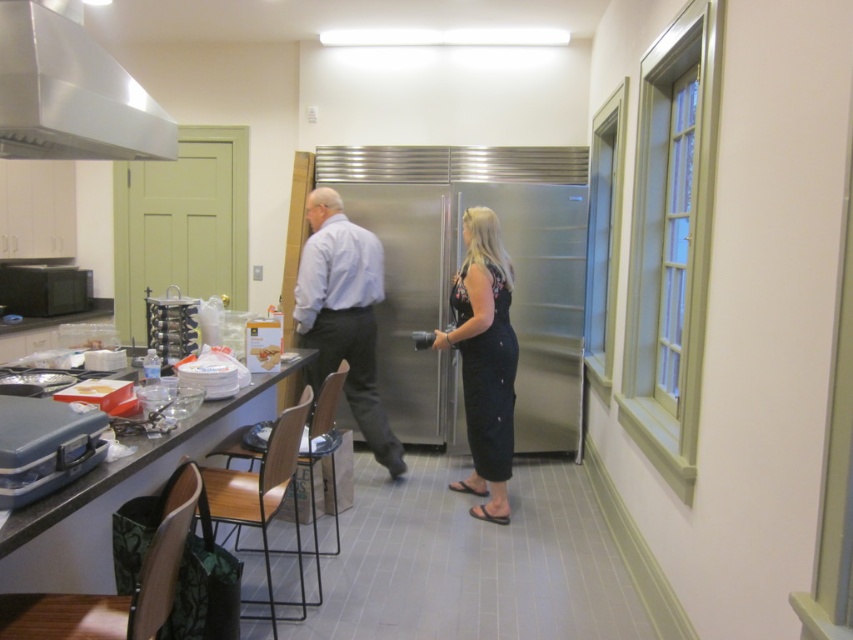
This screenshot has height=640, width=853. In order to click on stainless steel exhaust hood at upper left in this screenshot , I will do `click(70, 93)`.

Measure the distance between point (94, 129) and camera.

A distance of 7.19 feet exists between point (94, 129) and camera.

Who is more distant from viewer, (9, 58) or (352, 275)?

Point (352, 275)

This screenshot has height=640, width=853. Find the location of `stainless steel exhaust hood at upper left`. stainless steel exhaust hood at upper left is located at coordinates (70, 93).

Who is shorter, stainless steel exhaust hood at upper left or stainless steel refrigerator at center?

stainless steel exhaust hood at upper left is shorter.

Can you confirm if stainless steel exhaust hood at upper left is wider than stainless steel refrigerator at center?

Yes, stainless steel exhaust hood at upper left is wider than stainless steel refrigerator at center.

Locate an element on the screen. Image resolution: width=853 pixels, height=640 pixels. stainless steel exhaust hood at upper left is located at coordinates (70, 93).

Which is below, light blue shirt at center or black floral dress at center?

black floral dress at center is lower down.

From the picture: Who is more forward, (381, 449) or (474, 339)?

Positioned in front is point (474, 339).

You are a GUI agent. You are given a task and a screenshot of the screen. Output one action in this format:
    pyautogui.click(x=<x>, y=<y>)
    Task: Click on the light blue shirt at center
    The height and width of the screenshot is (640, 853).
    Given the screenshot: What is the action you would take?
    pyautogui.click(x=344, y=316)